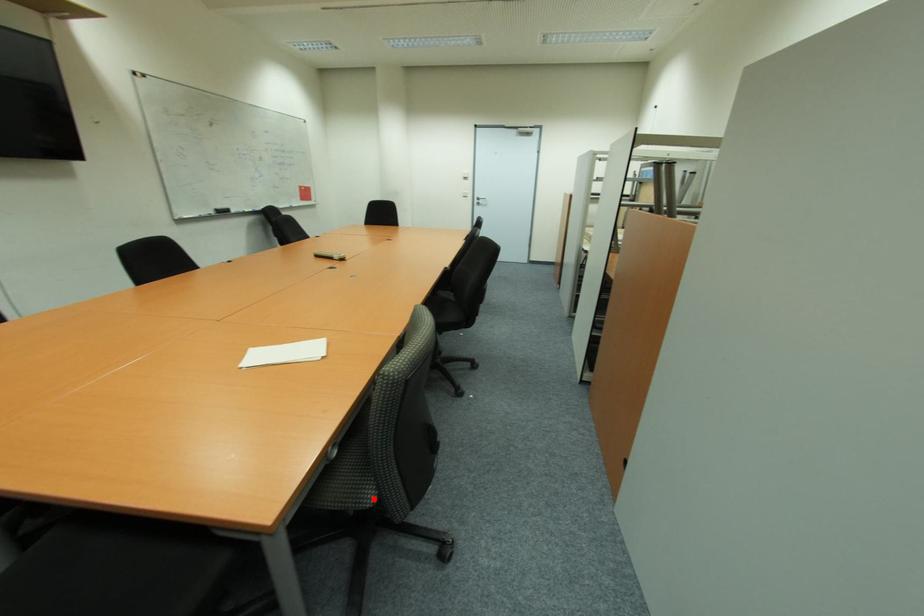
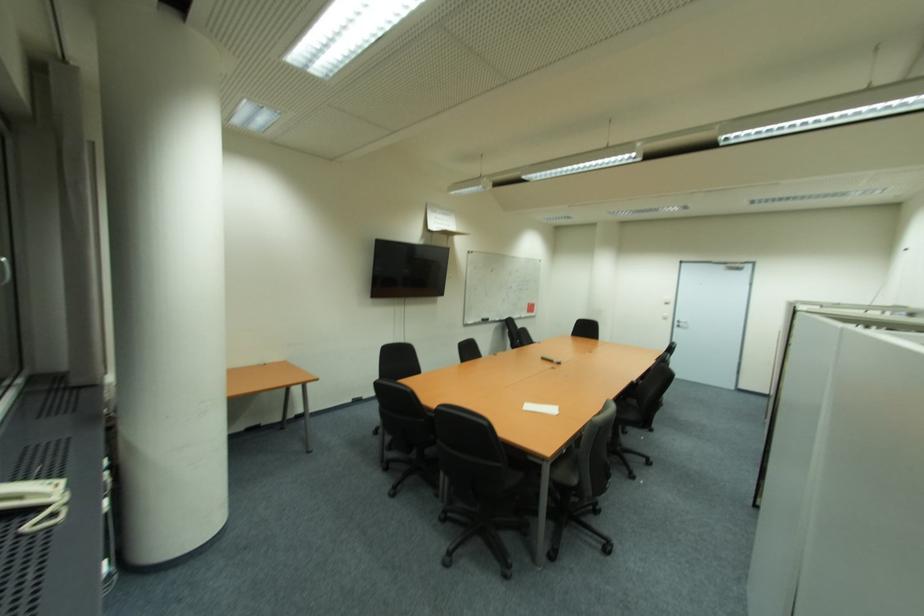
Question: I am providing you with two images of the same scene from different viewpoints. Image1 has a red point marked. In image2, the corresponding 3D location appears at what relative position? Reply with the corresponding letter.

Choices:
 (A) Closer
 (B) Farther

Answer: (B)